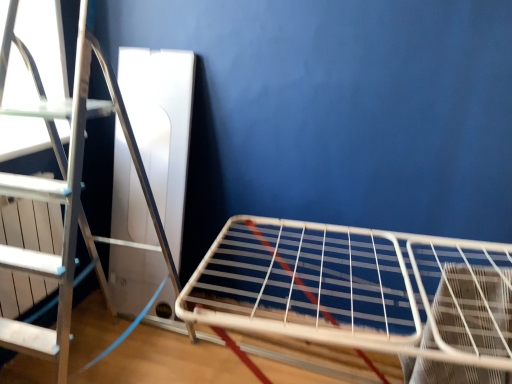
Question: Should I look upward or downward to see white wire rack at lower right?

Choices:
 (A) down
 (B) up

Answer: (A)

Question: From the image's perspective, would you say silver metallic ladder at left is positioned over white wire rack at lower right?

Choices:
 (A) yes
 (B) no

Answer: (A)

Question: Is silver metallic ladder at left not inside white wire rack at lower right?

Choices:
 (A) yes
 (B) no

Answer: (A)

Question: Does silver metallic ladder at left have a lesser width compared to white wire rack at lower right?

Choices:
 (A) yes
 (B) no

Answer: (A)

Question: Can you confirm if silver metallic ladder at left is shorter than white wire rack at lower right?

Choices:
 (A) no
 (B) yes

Answer: (A)

Question: Would you consider silver metallic ladder at left to be distant from white wire rack at lower right?

Choices:
 (A) yes
 (B) no

Answer: (B)

Question: Is silver metallic ladder at left taller than white wire rack at lower right?

Choices:
 (A) no
 (B) yes

Answer: (B)

Question: Would you say white wire rack at lower right is a long distance from silver metallic ladder at left?

Choices:
 (A) no
 (B) yes

Answer: (A)

Question: Considering the relative positions of white wire rack at lower right and silver metallic ladder at left in the image provided, is white wire rack at lower right to the right of silver metallic ladder at left from the viewer's perspective?

Choices:
 (A) yes
 (B) no

Answer: (A)

Question: From the image's perspective, is white wire rack at lower right on top of silver metallic ladder at left?

Choices:
 (A) yes
 (B) no

Answer: (B)

Question: From the image's perspective, is white wire rack at lower right below silver metallic ladder at left?

Choices:
 (A) no
 (B) yes

Answer: (B)

Question: Does white wire rack at lower right have a lesser height compared to silver metallic ladder at left?

Choices:
 (A) yes
 (B) no

Answer: (A)

Question: Considering the relative positions of white wire rack at lower right and silver metallic ladder at left in the image provided, is white wire rack at lower right behind silver metallic ladder at left?

Choices:
 (A) yes
 (B) no

Answer: (B)

Question: Is white wire rack at lower right wider or thinner than silver metallic ladder at left?

Choices:
 (A) wide
 (B) thin

Answer: (A)